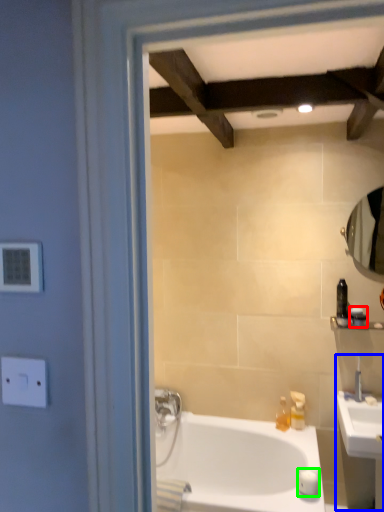
Question: Estimate the real-world distances between objects in this image. Which object is farther from toiletry (highlighted by a red box), sink (highlighted by a blue box) or soap (highlighted by a green box)?

Choices:
 (A) sink
 (B) soap

Answer: (B)